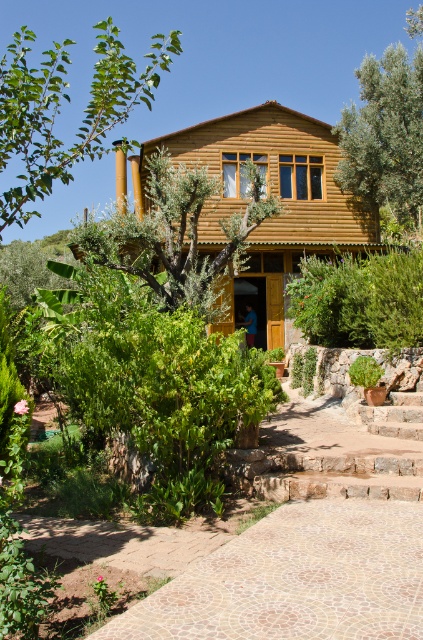
Based on the photo, based on the scene description, which green leafy tree has a greater width between the green leafy tree at upper left and the green leafy tree at center?

The green leafy tree at upper left has a greater width than the green leafy tree at center.

You are a visitor approaching the rustic wooden house and want to reach the entrance. You see the mosaic stone path at lower center and the green leafy tree at center. Which direction should you walk to avoid the tree and head towards the entrance?

The mosaic stone path at lower center is positioned on the right side of the green leafy tree at center, so to avoid the tree and head towards the entrance, you should walk to the right of the green leafy tree at center along the mosaic stone path at lower center.